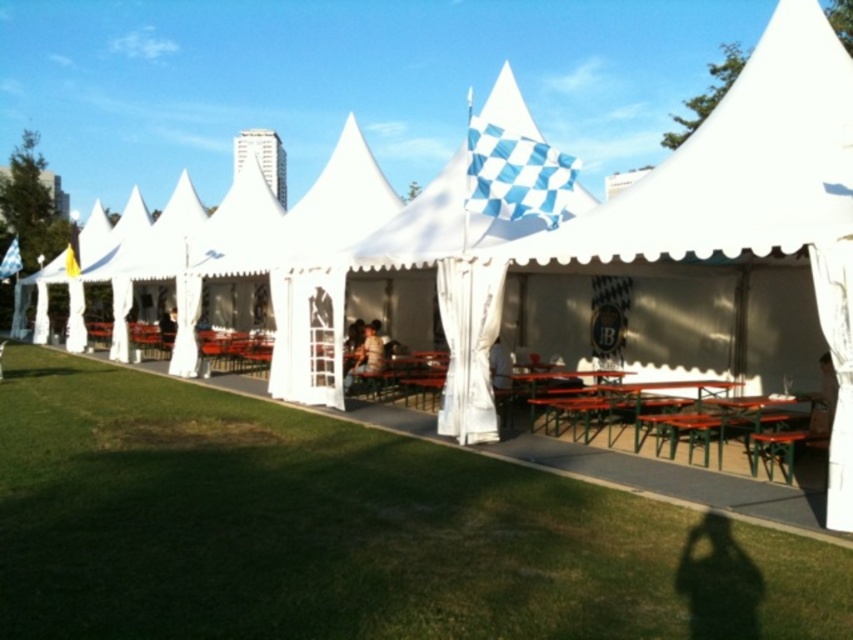
Question: Based on their relative distances, which object is farther from the green grass at lower left?

Choices:
 (A) green metal table at center
 (B) wooden picnic table at center

Answer: (A)

Question: Among these points, which one is nearest to the camera?

Choices:
 (A) (706, 410)
 (B) (685, 385)
 (C) (573, 529)

Answer: (C)

Question: Is wooden picnic table at center bigger than green metal table at center?

Choices:
 (A) no
 (B) yes

Answer: (B)

Question: Among these points, which one is nearest to the camera?

Choices:
 (A) click(270, 497)
 (B) click(683, 387)
 (C) click(746, 470)

Answer: (A)

Question: Can you confirm if wooden picnic table at center is bigger than green metal table at center?

Choices:
 (A) yes
 (B) no

Answer: (A)

Question: Does green grass at lower left come behind green metal table at center?

Choices:
 (A) no
 (B) yes

Answer: (A)